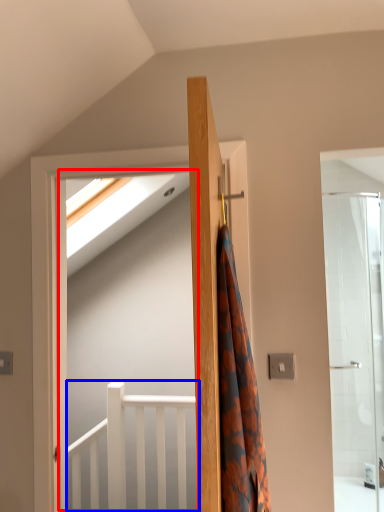
Question: Which object appears farthest to the camera in this image, screen door (highlighted by a red box) or balustrade (highlighted by a blue box)?

Choices:
 (A) screen door
 (B) balustrade

Answer: (B)